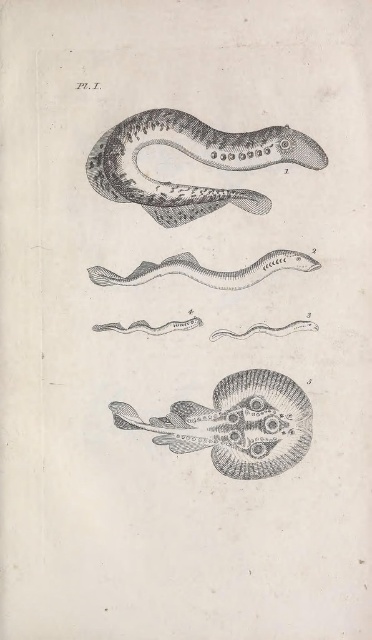
What does the point at coordinates (193, 157) in the image represent?

The point at coordinates (193, 157) represents the black line drawing snake at upper center.

You are an artist reviewing this scientific illustration. You need to determine which of the two snakes, the black line drawing snake at upper center or the gray line drawing snake at center, is drawn larger in height. Based on the illustration, which one is taller?

The black line drawing snake at upper center has a greater height compared to the gray line drawing snake at center, so the black line drawing snake at upper center is taller.